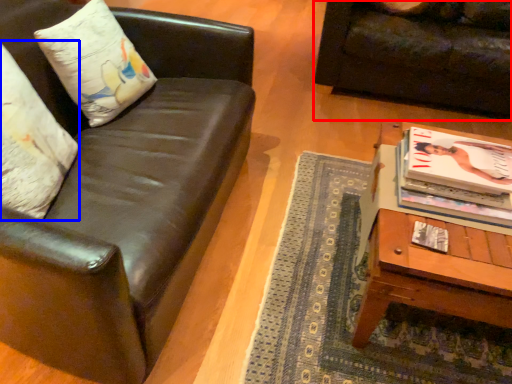
Question: Which of the following is the farthest to the observer, studio couch (highlighted by a red box) or pillow (highlighted by a blue box)?

Choices:
 (A) studio couch
 (B) pillow

Answer: (A)